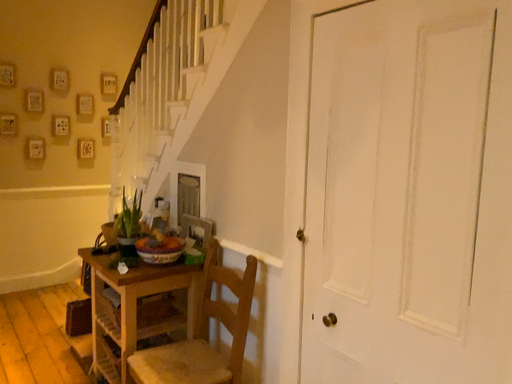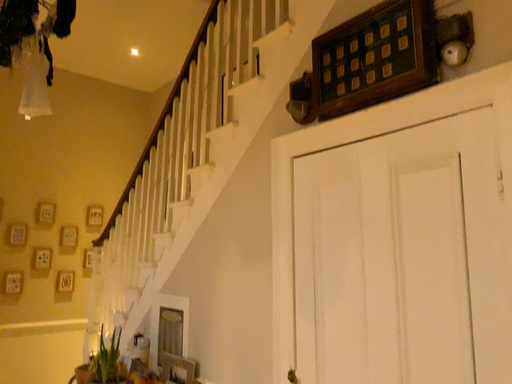
Question: How did the camera likely rotate when shooting the video?

Choices:
 (A) rotated downward
 (B) rotated upward

Answer: (B)